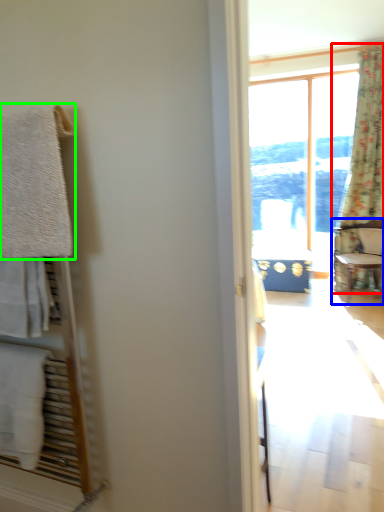
Question: Which is farther away from curtain (highlighted by a red box)? chair (highlighted by a blue box) or towel/napkin (highlighted by a green box)?

Choices:
 (A) chair
 (B) towel/napkin

Answer: (B)